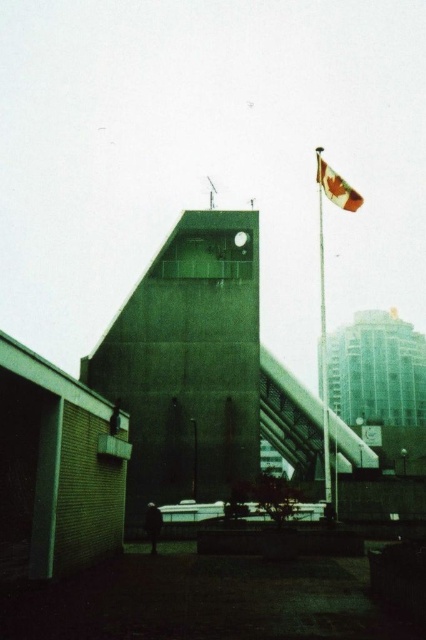
You are a city planner reviewing this urban layout. You need to determine the relative positioning of the polished metal flag pole at upper right and the red fabric flag at upper right. Which object is located more to the right?

The polished metal flag pole at upper right is positioned on the right side of the red fabric flag at upper right, so the flag pole is more to the right than the flag.

You are a city planner assessing the urban layout. Given the green concrete bell tower at center and the red fabric flag at upper right, which object is shorter in height?

The green concrete bell tower at center is shorter in height compared to the red fabric flag at upper right according to the description.